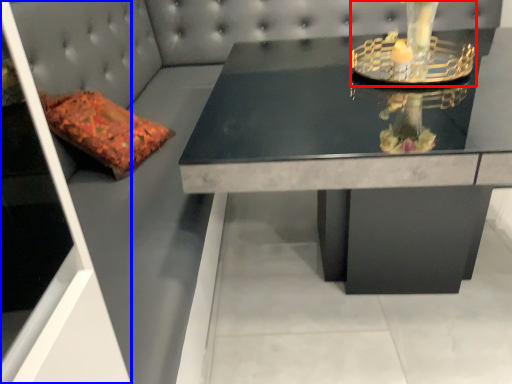
Question: Which object is closer to the camera taking this photo, candle holder (highlighted by a red box) or glass door (highlighted by a blue box)?

Choices:
 (A) candle holder
 (B) glass door

Answer: (B)